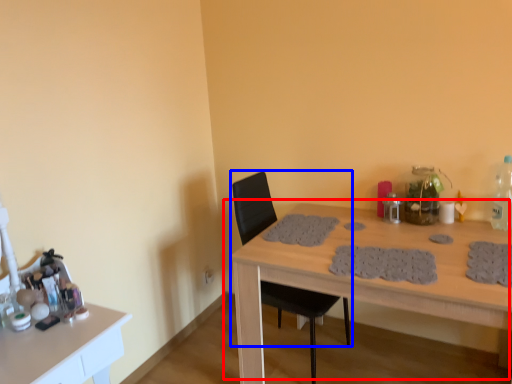
Question: Which object appears closest to the camera in this image, table (highlighted by a red box) or chair (highlighted by a blue box)?

Choices:
 (A) table
 (B) chair

Answer: (A)